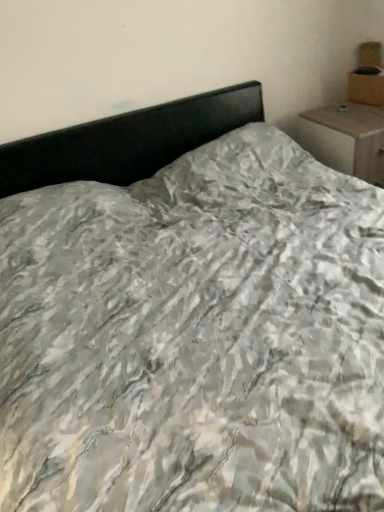
Question: Is cardboard box at upper right next to wooden nightstand at upper right?

Choices:
 (A) no
 (B) yes

Answer: (A)

Question: Is cardboard box at upper right completely or partially outside of wooden nightstand at upper right?

Choices:
 (A) no
 (B) yes

Answer: (B)

Question: From the image's perspective, is cardboard box at upper right on top of wooden nightstand at upper right?

Choices:
 (A) no
 (B) yes

Answer: (B)

Question: Does cardboard box at upper right contain wooden nightstand at upper right?

Choices:
 (A) no
 (B) yes

Answer: (A)

Question: Considering the relative sizes of cardboard box at upper right and wooden nightstand at upper right in the image provided, is cardboard box at upper right thinner than wooden nightstand at upper right?

Choices:
 (A) no
 (B) yes

Answer: (B)

Question: Is cardboard box at upper right looking in the opposite direction of wooden nightstand at upper right?

Choices:
 (A) yes
 (B) no

Answer: (B)

Question: Could you tell me if wooden nightstand at upper right is facing cardboard box at upper right?

Choices:
 (A) yes
 (B) no

Answer: (B)

Question: Can you confirm if wooden nightstand at upper right is wider than cardboard box at upper right?

Choices:
 (A) yes
 (B) no

Answer: (A)

Question: Is wooden nightstand at upper right at the left side of cardboard box at upper right?

Choices:
 (A) yes
 (B) no

Answer: (A)

Question: From the image's perspective, is wooden nightstand at upper right over cardboard box at upper right?

Choices:
 (A) yes
 (B) no

Answer: (B)

Question: Is wooden nightstand at upper right located outside cardboard box at upper right?

Choices:
 (A) no
 (B) yes

Answer: (B)

Question: Considering the relative sizes of wooden nightstand at upper right and cardboard box at upper right in the image provided, is wooden nightstand at upper right shorter than cardboard box at upper right?

Choices:
 (A) yes
 (B) no

Answer: (B)

Question: Is point (382, 77) closer or farther from the camera than point (312, 153)?

Choices:
 (A) closer
 (B) farther

Answer: (A)